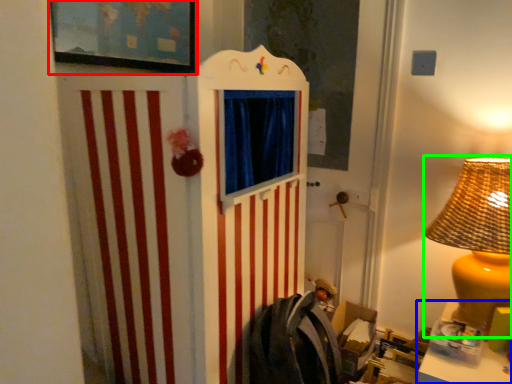
Question: Which object is the farthest from picture frame (highlighted by a red box)? Choose among these: table (highlighted by a blue box) or table lamp (highlighted by a green box).

Choices:
 (A) table
 (B) table lamp

Answer: (A)